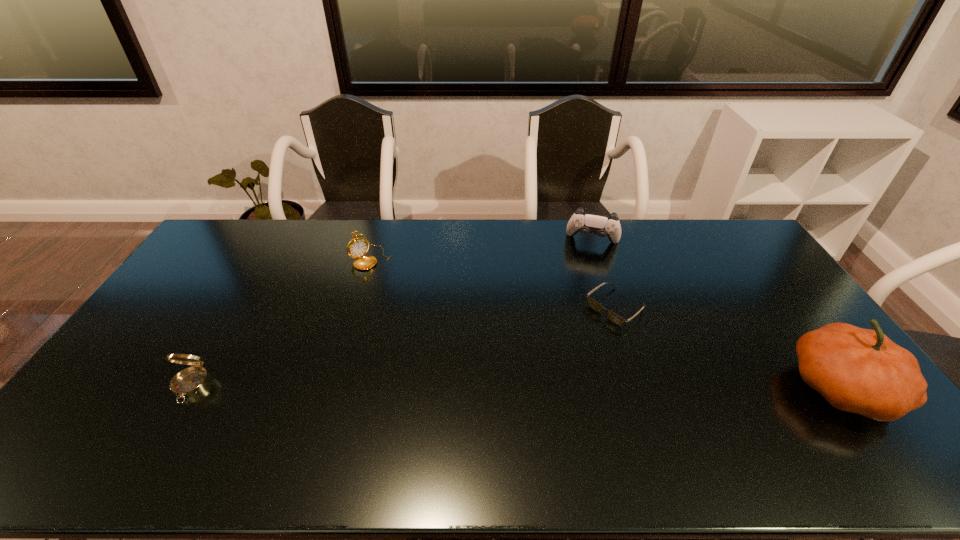
The height and width of the screenshot is (540, 960). I want to click on vacant space on the desktop that is between the compass and the tallest object and is positioned on the face of the pocket watch, so click(x=492, y=387).

At what (x,y) coordinates should I click in order to perform the action: click on vacant spot on the desktop that is between the leftmost object and the pumpkin and is positioned on the front-facing side of the third nearest object. Please return your answer as a coordinate pair (x, y). This screenshot has height=540, width=960. Looking at the image, I should click on (515, 387).

Identify the location of vacant space on the desktop that is between the leftmost object and the tallest object and is positioned on the front-facing side of the control. The height and width of the screenshot is (540, 960). (566, 387).